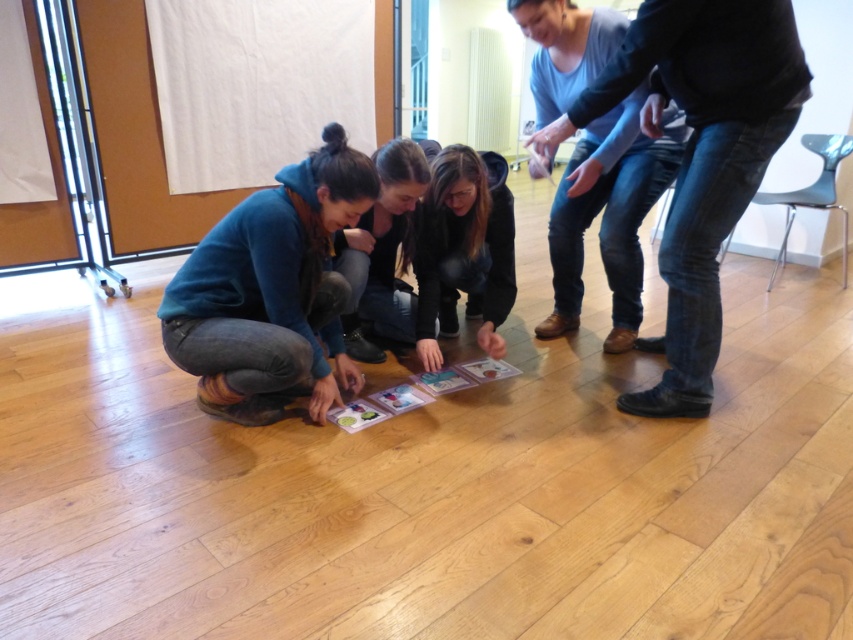
Image resolution: width=853 pixels, height=640 pixels. I want to click on jeans at center, so click(x=700, y=156).

Describe the element at coordinates (700, 156) in the screenshot. I see `jeans at center` at that location.

Where is `jeans at center`? Image resolution: width=853 pixels, height=640 pixels. jeans at center is located at coordinates (700, 156).

Consider the image. Between denim jeans at lower left and matte black hoodie at center, which one has more height?

With more height is denim jeans at lower left.

From the picture: Is denim jeans at lower left to the left of matte black hoodie at center from the viewer's perspective?

Indeed, denim jeans at lower left is positioned on the left side of matte black hoodie at center.

Between point (354, 385) and point (416, 218), which one is positioned behind?

The point (416, 218) is more distant.

Locate an element on the screen. The width and height of the screenshot is (853, 640). denim jeans at lower left is located at coordinates (271, 291).

Is point (635, 84) closer to camera compared to point (410, 400)?

Yes, point (635, 84) is in front of point (410, 400).

Who is more distant from viewer, (753,154) or (459,385)?

The point (459,385) is behind.

What are the coordinates of `jeans at center` in the screenshot? It's located at (700, 156).

In order to click on jeans at center in this screenshot , I will do `click(700, 156)`.